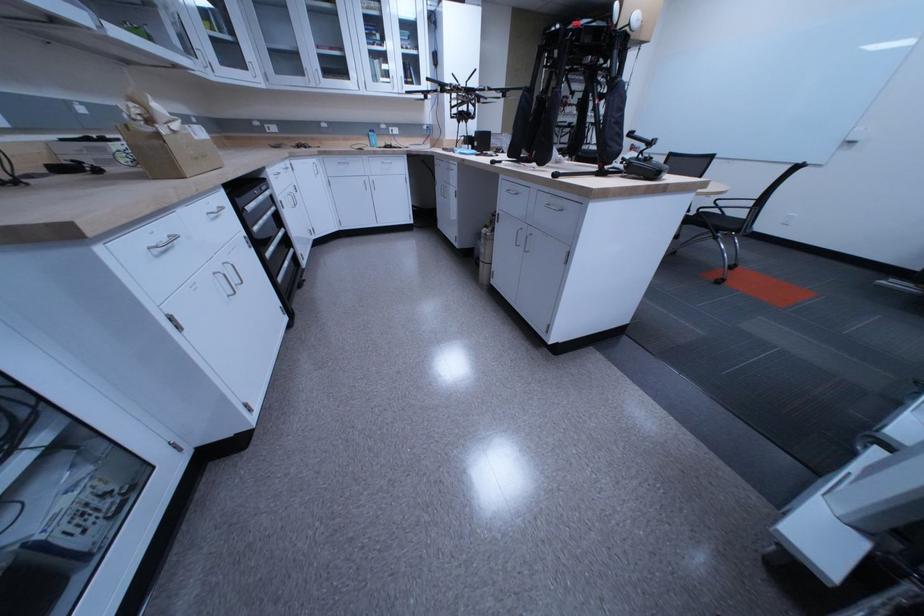
You are a GUI agent. You are given a task and a screenshot of the screen. Output one action in this format:
    pyautogui.click(x=<x>, y=<y>)
    Task: Click on the chair armrest
    
    Given the screenshot: What is the action you would take?
    pyautogui.click(x=730, y=207)